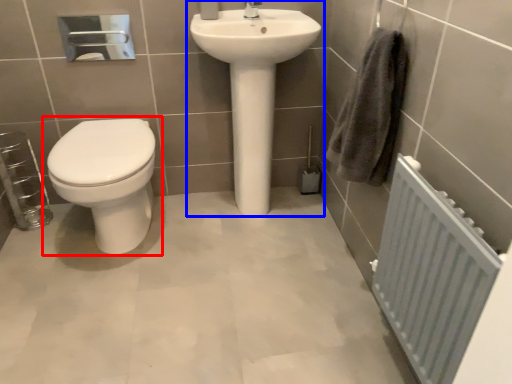
Question: Which object is further to the camera taking this photo, toilet (highlighted by a red box) or sink (highlighted by a blue box)?

Choices:
 (A) toilet
 (B) sink

Answer: (B)